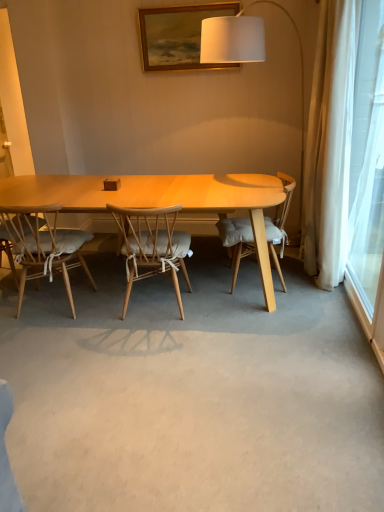
In order to click on space that is in front of natural wood chair with cushion at center, the 2th chair in the left-to-right sequence in this screenshot , I will do `click(151, 347)`.